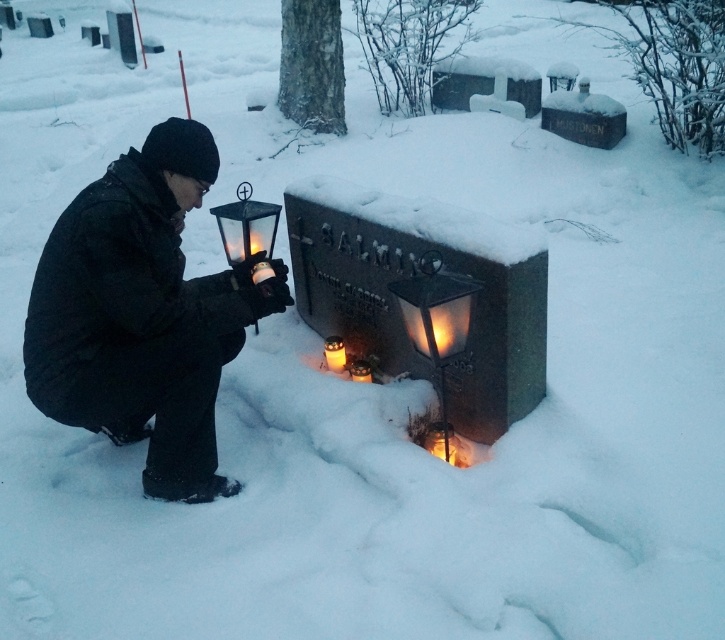
Question: Which point is closer to the camera taking this photo?

Choices:
 (A) (368, 372)
 (B) (149, 275)

Answer: (B)

Question: Which point is farther from the camera taking this photo?

Choices:
 (A) (423, 355)
 (B) (239, 220)
 (C) (418, 272)

Answer: (B)

Question: Is matte glass lantern at center wider than translucent glass candle at center?

Choices:
 (A) no
 (B) yes

Answer: (B)

Question: Is matte glass lantern at center to the left of black glass lantern at center from the viewer's perspective?

Choices:
 (A) yes
 (B) no

Answer: (B)

Question: From the image, what is the correct spatial relationship of black glass lantern at center in relation to matte glass candle at center?

Choices:
 (A) left
 (B) right

Answer: (A)

Question: Which object appears closest to the camera in this image?

Choices:
 (A) black glass lantern at center
 (B) matte glass candle at center
 (C) matte glass lantern at center
 (D) black matte lantern at left

Answer: (C)